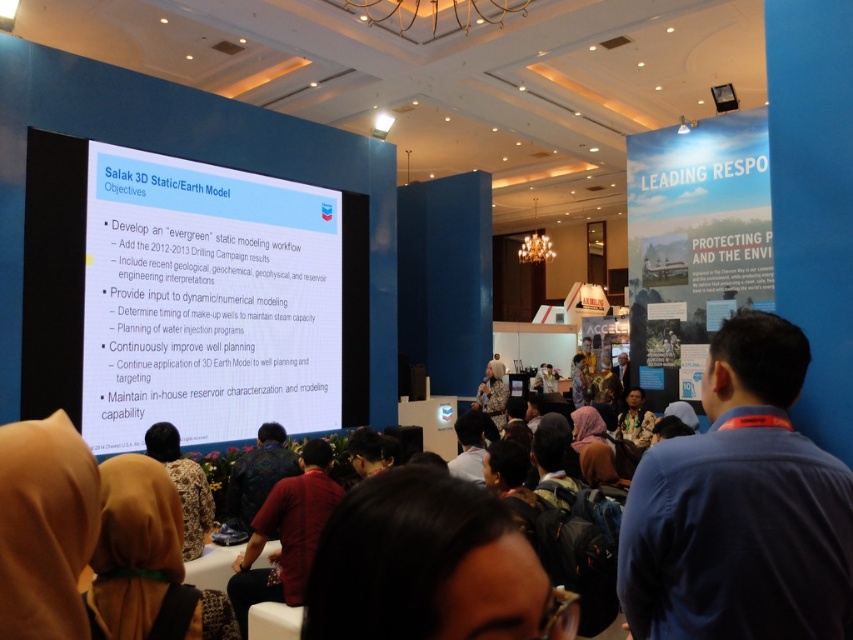
In the scene shown: You are an attendee at this conference and you see the blue shirt at center and the dark brown hair at center. Which one is positioned more to the right side of the image?

The blue shirt at center is positioned to the right of dark brown hair at center, so the blue shirt at center is more to the right.

In the scene shown: You are an attendee at this conference and you want to take a photo of the presentation screen. You notice two people in front of you with dark brown hair at center and red cotton shirt at center. Which person is blocking your view less?

The dark brown hair at center has a lesser height compared to red cotton shirt at center, so the dark brown hair at center is blocking your view less.

You are an attendee at this conference and you want to introduce yourself to the person with dark brown hair at center. Which side of the red cotton shirt at center should you approach from?

You should approach from the right side of the red cotton shirt at center because the dark brown hair at center is located to the right of the red cotton shirt at center.